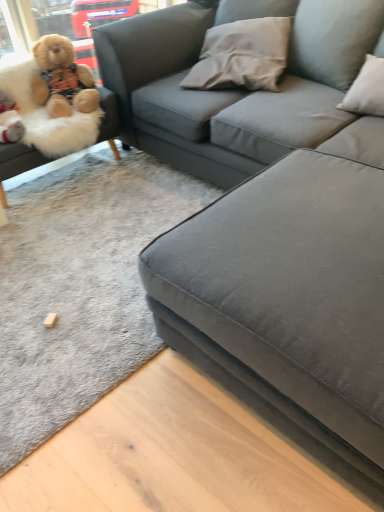
You are a GUI agent. You are given a task and a screenshot of the screen. Output one action in this format:
    pyautogui.click(x=<x>, y=<y>)
    Task: Click on the gray fabric pillow at upper center
    This screenshot has height=512, width=384.
    Given the screenshot: What is the action you would take?
    pyautogui.click(x=242, y=55)

What are the coordinates of `fluffy beige teddy bear at left, which is counted as the first studio couch, starting from the left` in the screenshot? It's located at (19, 161).

The height and width of the screenshot is (512, 384). What do you see at coordinates (271, 203) in the screenshot?
I see `suede gray couch at center, placed as the first studio couch when sorted from right to left` at bounding box center [271, 203].

You are a GUI agent. You are given a task and a screenshot of the screen. Output one action in this format:
    pyautogui.click(x=<x>, y=<y>)
    Task: Click on the fluffy beige teddy bear at upper left
    This screenshot has width=384, height=512.
    Given the screenshot: What is the action you would take?
    pyautogui.click(x=62, y=79)

Based on the photo, from the image's perspective, who appears lower, gray fabric pillow at upper center or fluffy beige teddy bear at left, which is counted as the first studio couch, starting from the left?

fluffy beige teddy bear at left, which is counted as the first studio couch, starting from the left.

Is gray fabric pillow at upper center oriented away from fluffy beige teddy bear at left, which is counted as the first studio couch, starting from the left?

No, gray fabric pillow at upper center is not facing away from fluffy beige teddy bear at left, which is counted as the first studio couch, starting from the left.

Is gray fabric pillow at upper center wider than fluffy beige teddy bear at left, the 2th studio couch viewed from the right?

Incorrect, the width of gray fabric pillow at upper center does not surpass that of fluffy beige teddy bear at left, the 2th studio couch viewed from the right.

Could fluffy beige teddy bear at upper left be considered to be inside gray fabric pillow at upper center?

Actually, fluffy beige teddy bear at upper left is outside gray fabric pillow at upper center.

How many degrees apart are the facing directions of gray fabric pillow at upper center and fluffy beige teddy bear at upper left?

gray fabric pillow at upper center and fluffy beige teddy bear at upper left are facing 66.3 degrees away from each other.

Considering the relative sizes of gray fabric pillow at upper center and fluffy beige teddy bear at upper left in the image provided, is gray fabric pillow at upper center shorter than fluffy beige teddy bear at upper left?

Indeed, gray fabric pillow at upper center has a lesser height compared to fluffy beige teddy bear at upper left.

Does gray fabric pillow at upper center have a lesser width compared to fluffy beige teddy bear at upper left?

No, gray fabric pillow at upper center is not thinner than fluffy beige teddy bear at upper left.

Does fluffy beige teddy bear at upper left lie in front of fluffy beige teddy bear at left, which is counted as the first studio couch, starting from the left?

No, it is not.

Who is bigger, fluffy beige teddy bear at upper left or fluffy beige teddy bear at left, the 2th studio couch viewed from the right?

fluffy beige teddy bear at left, the 2th studio couch viewed from the right.

In terms of width, does fluffy beige teddy bear at upper left look wider or thinner when compared to fluffy beige teddy bear at left, which is counted as the first studio couch, starting from the left?

Considering their sizes, fluffy beige teddy bear at upper left looks slimmer than fluffy beige teddy bear at left, which is counted as the first studio couch, starting from the left.

I want to click on pillow on the left of suede gray couch at center, placed as the first studio couch when sorted from right to left, so click(x=242, y=55).

Is suede gray couch at center, which ranks as the 2th studio couch in left-to-right order, in front of gray fabric pillow at upper center?

Yes, it is.

From the image's perspective, would you say suede gray couch at center, which ranks as the 2th studio couch in left-to-right order, is shown under gray fabric pillow at upper center?

Correct, suede gray couch at center, which ranks as the 2th studio couch in left-to-right order, appears lower than gray fabric pillow at upper center in the image.

Is point (21, 167) closer or farther from the camera than point (123, 90)?

Clearly, point (21, 167) is closer to the camera than point (123, 90).

Looking at this image, is fluffy beige teddy bear at left, the 2th studio couch viewed from the right, facing towards suede gray couch at center, placed as the first studio couch when sorted from right to left?

Yes, fluffy beige teddy bear at left, the 2th studio couch viewed from the right, is aimed at suede gray couch at center, placed as the first studio couch when sorted from right to left.

From a real-world perspective, is fluffy beige teddy bear at left, which is counted as the first studio couch, starting from the left, positioned over suede gray couch at center, which ranks as the 2th studio couch in left-to-right order, based on gravity?

Incorrect, from a real-world perspective, fluffy beige teddy bear at left, which is counted as the first studio couch, starting from the left, is lower than suede gray couch at center, which ranks as the 2th studio couch in left-to-right order.

Could fluffy beige teddy bear at left, the 2th studio couch viewed from the right, be considered to be inside suede gray couch at center, which ranks as the 2th studio couch in left-to-right order?

Yes, fluffy beige teddy bear at left, the 2th studio couch viewed from the right, is inside suede gray couch at center, which ranks as the 2th studio couch in left-to-right order.

From the image's perspective, is suede gray couch at center, which ranks as the 2th studio couch in left-to-right order, above or below fluffy beige teddy bear at left, the 2th studio couch viewed from the right?

suede gray couch at center, which ranks as the 2th studio couch in left-to-right order, is situated lower than fluffy beige teddy bear at left, the 2th studio couch viewed from the right, in the image.

Which of these two, suede gray couch at center, which ranks as the 2th studio couch in left-to-right order, or fluffy beige teddy bear at left, which is counted as the first studio couch, starting from the left, stands taller?

suede gray couch at center, which ranks as the 2th studio couch in left-to-right order, is taller.

Is point (302, 372) closer to viewer compared to point (105, 102)?

Yes, it is.

From the image's perspective, is gray fabric pillow at upper center above suede gray couch at center, placed as the first studio couch when sorted from right to left?

Yes, from the image's perspective, gray fabric pillow at upper center is over suede gray couch at center, placed as the first studio couch when sorted from right to left.

Between gray fabric pillow at upper center and suede gray couch at center, placed as the first studio couch when sorted from right to left, which one is positioned in front?

Positioned in front is suede gray couch at center, placed as the first studio couch when sorted from right to left.

Is gray fabric pillow at upper center outside of suede gray couch at center, which ranks as the 2th studio couch in left-to-right order?

No, gray fabric pillow at upper center is not entirely external to suede gray couch at center, which ranks as the 2th studio couch in left-to-right order.

The image size is (384, 512). Identify the location of pillow located on the right of fluffy beige teddy bear at left, the 2th studio couch viewed from the right. (242, 55).

The height and width of the screenshot is (512, 384). Identify the location of teddy bear below the gray fabric pillow at upper center (from the image's perspective). (62, 79).

Which object lies nearer to the anchor point gray fabric pillow at upper center, suede gray couch at center, placed as the first studio couch when sorted from right to left, or fluffy beige teddy bear at upper left?

Based on the image, suede gray couch at center, placed as the first studio couch when sorted from right to left, appears to be nearer to gray fabric pillow at upper center.

When comparing their distances from suede gray couch at center, which ranks as the 2th studio couch in left-to-right order, does fluffy beige teddy bear at left, which is counted as the first studio couch, starting from the left, or gray fabric pillow at upper center seem closer?

Based on the image, gray fabric pillow at upper center appears to be nearer to suede gray couch at center, which ranks as the 2th studio couch in left-to-right order.

From the image, which object appears to be farther from fluffy beige teddy bear at upper left, gray fabric pillow at upper center or suede gray couch at center, which ranks as the 2th studio couch in left-to-right order?

Based on the image, gray fabric pillow at upper center appears to be further to fluffy beige teddy bear at upper left.

Looking at the image, which one is located further to gray fabric pillow at upper center, fluffy beige teddy bear at left, which is counted as the first studio couch, starting from the left, or suede gray couch at center, which ranks as the 2th studio couch in left-to-right order?

Among the two, fluffy beige teddy bear at left, which is counted as the first studio couch, starting from the left, is located further to gray fabric pillow at upper center.

Considering their positions, is suede gray couch at center, placed as the first studio couch when sorted from right to left, positioned closer to fluffy beige teddy bear at left, which is counted as the first studio couch, starting from the left, than gray fabric pillow at upper center?

The object closer to fluffy beige teddy bear at left, which is counted as the first studio couch, starting from the left, is gray fabric pillow at upper center.

Estimate the real-world distances between objects in this image. Which object is further from gray fabric pillow at upper center, fluffy beige teddy bear at upper left or suede gray couch at center, which ranks as the 2th studio couch in left-to-right order?

Among the two, fluffy beige teddy bear at upper left is located further to gray fabric pillow at upper center.

When comparing their distances from suede gray couch at center, placed as the first studio couch when sorted from right to left, does gray fabric pillow at upper center or fluffy beige teddy bear at upper left seem further?

fluffy beige teddy bear at upper left.

Estimate the real-world distances between objects in this image. Which object is closer to gray fabric pillow at upper center, fluffy beige teddy bear at left, the 2th studio couch viewed from the right, or fluffy beige teddy bear at upper left?

fluffy beige teddy bear at left, the 2th studio couch viewed from the right.

Where is `teddy bear located between fluffy beige teddy bear at left, which is counted as the first studio couch, starting from the left, and gray fabric pillow at upper center in the left-right direction`? The image size is (384, 512). teddy bear located between fluffy beige teddy bear at left, which is counted as the first studio couch, starting from the left, and gray fabric pillow at upper center in the left-right direction is located at coordinates (62, 79).

Find the location of a particular element. studio couch between suede gray couch at center, placed as the first studio couch when sorted from right to left, and gray fabric pillow at upper center from front to back is located at coordinates (19, 161).

Locate an element on the screen. This screenshot has width=384, height=512. pillow between suede gray couch at center, which ranks as the 2th studio couch in left-to-right order, and fluffy beige teddy bear at upper left, along the z-axis is located at coordinates (242, 55).

You are a GUI agent. You are given a task and a screenshot of the screen. Output one action in this format:
    pyautogui.click(x=<x>, y=<y>)
    Task: Click on the studio couch between suede gray couch at center, placed as the first studio couch when sorted from right to left, and fluffy beige teddy bear at upper left, along the z-axis
    
    Given the screenshot: What is the action you would take?
    click(x=19, y=161)